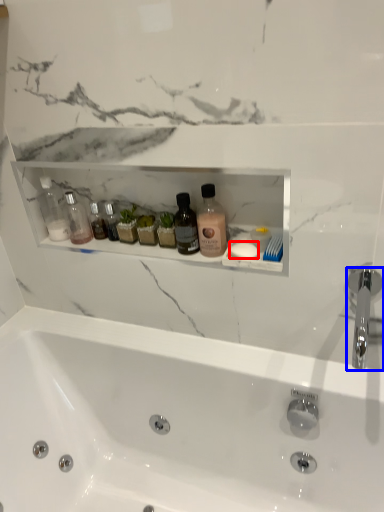
Question: Which object appears closest to the camera in this image, soap (highlighted by a red box) or tap (highlighted by a blue box)?

Choices:
 (A) soap
 (B) tap

Answer: (B)